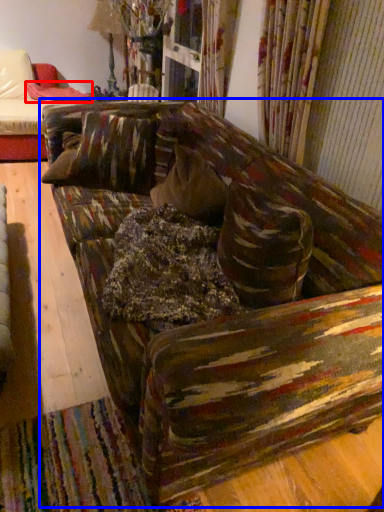
Question: Which object is closer to the camera taking this photo, blanket (highlighted by a red box) or studio couch (highlighted by a blue box)?

Choices:
 (A) blanket
 (B) studio couch

Answer: (B)